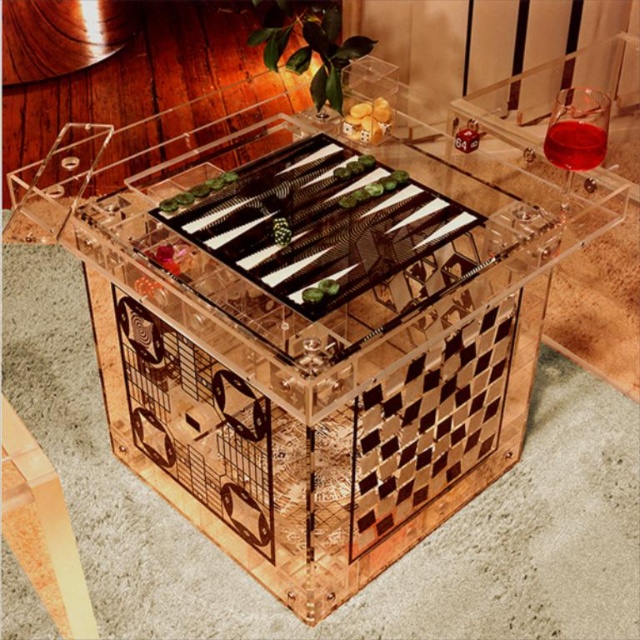
Which is behind, point (566, 154) or point (378, 108)?

The point (378, 108) is behind.

Can you confirm if transparent liquid at upper right is positioned to the right of translucent plastic dice at center?

Indeed, transparent liquid at upper right is positioned on the right side of translucent plastic dice at center.

Identify the location of transparent liquid at upper right. (573, 145).

Locate an element on the screen. transparent liquid at upper right is located at coordinates (573, 145).

Can you confirm if transparent glass wine at upper right is wider than transparent liquid at upper right?

Indeed, transparent glass wine at upper right has a greater width compared to transparent liquid at upper right.

Is point (566, 176) more distant than point (556, 157)?

That is True.

I want to click on transparent glass wine at upper right, so click(577, 132).

Can you confirm if transparent glass wine at upper right is bigger than translucent plastic dice at center?

Yes, transparent glass wine at upper right is bigger than translucent plastic dice at center.

Does transparent glass wine at upper right have a smaller size compared to translucent plastic dice at center?

Actually, transparent glass wine at upper right might be larger than translucent plastic dice at center.

Which is behind, point (564, 192) or point (378, 136)?

Point (378, 136)

Where is `transparent glass wine at upper right`? The width and height of the screenshot is (640, 640). transparent glass wine at upper right is located at coordinates (577, 132).